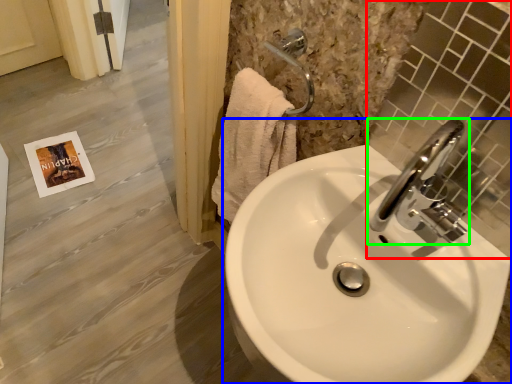
Question: Based on their relative distances, which object is nearer to mirror (highlighted by a red box)? Choose from sink (highlighted by a blue box) and tap (highlighted by a green box).

Choices:
 (A) sink
 (B) tap

Answer: (B)